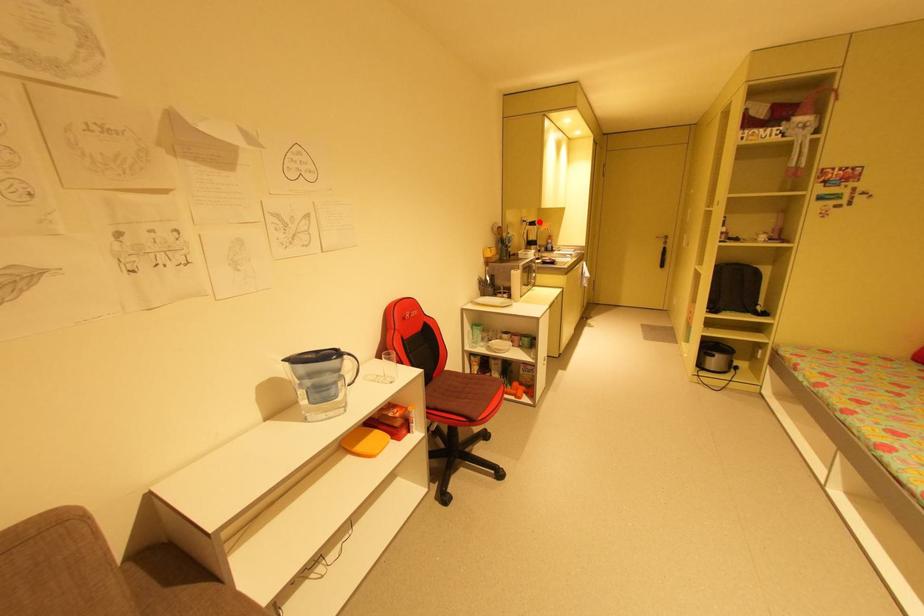
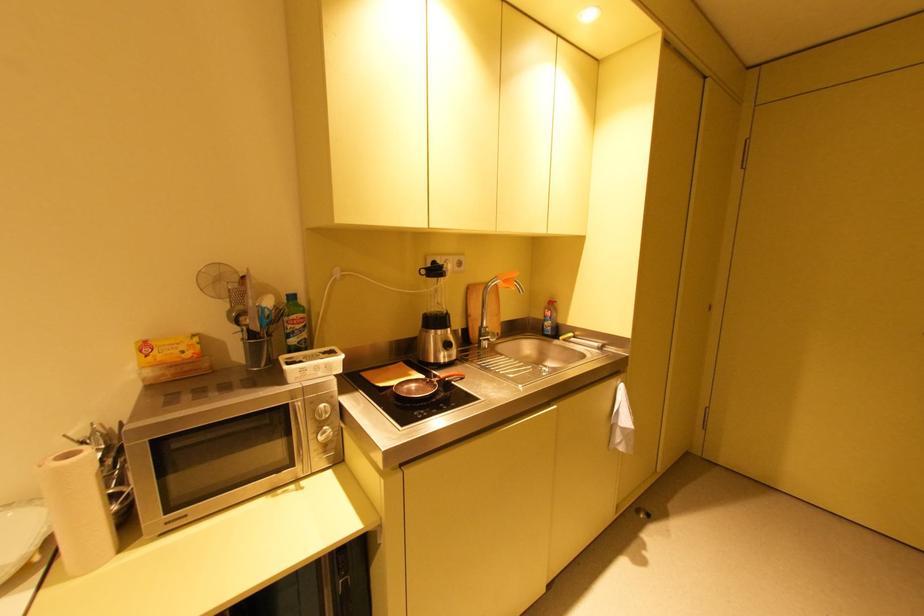
Question: A red point is marked in image1. In image2, is the corresponding 3D point closer to the camera or farther? Reply with the corresponding letter.

Choices:
 (A) The corresponding 3D point is closer.
 (B) The corresponding 3D point is farther.

Answer: (B)